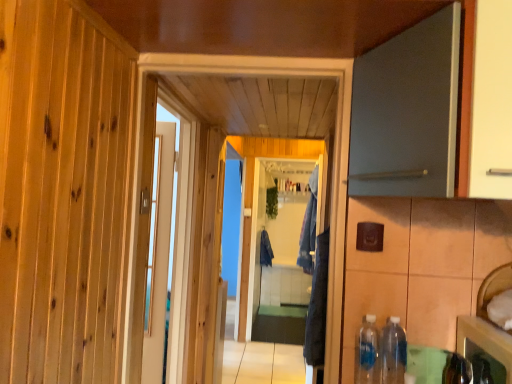
Question: Is blue fabric laundry at center, the second laundry in the back-to-front sequence, spatially inside white glossy door at center, which is counted as the first door, starting from the left, or outside of it?

Choices:
 (A) inside
 (B) outside

Answer: (B)

Question: Is blue fabric laundry at center, which is the 1th laundry in right-to-left order, taller or shorter than white glossy door at center, which is counted as the 2th door, starting from the front?

Choices:
 (A) tall
 (B) short

Answer: (B)

Question: Estimate the real-world distances between objects in this image. Which object is closer to the matte gray door at upper right, placed as the 1th door when sorted from front to back?

Choices:
 (A) translucent plastic bottle at lower right, which is counted as the 1th bottle, starting from the left
 (B) dark blue fabric at center, which is counted as the 1th laundry, starting from the back
 (C) shiny metallic cabinet at lower right
 (D) white glossy door at center, the second door when ordered from right to left
 (E) clear glass screen door at center

Answer: (C)

Question: Estimate the real-world distances between objects in this image. Which object is farther from the matte gray door at upper right, placed as the 1th door when sorted from front to back?

Choices:
 (A) clear glass screen door at center
 (B) white glossy door at center, the second door when ordered from right to left
 (C) blue fabric laundry at center, the second laundry in the back-to-front sequence
 (D) translucent plastic bottle at lower right, which ranks as the 2th bottle in right-to-left order
 (E) shiny metallic cabinet at lower right

Answer: (A)